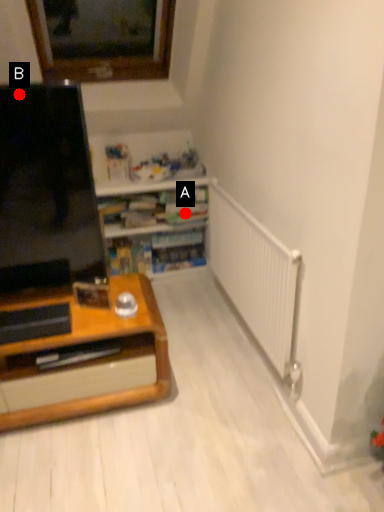
Question: Two points are circled on the image, labeled by A and B beside each circle. Which of the following is the closest to the observer?

Choices:
 (A) A is closer
 (B) B is closer

Answer: (B)